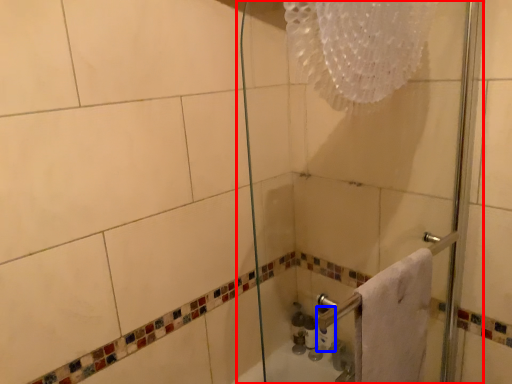
Question: Which of the following is the farthest to the observer, shower door (highlighted by a red box) or toilet paper (highlighted by a blue box)?

Choices:
 (A) shower door
 (B) toilet paper

Answer: (B)